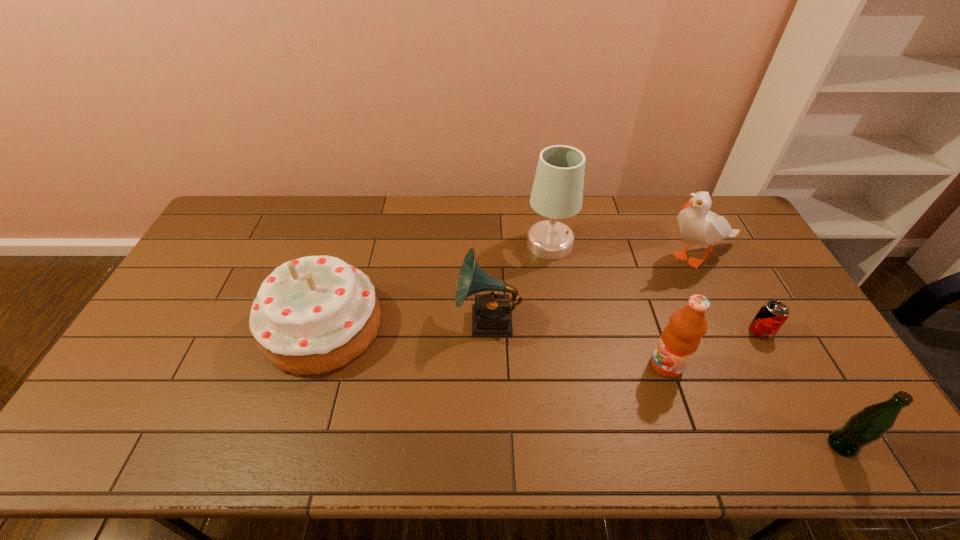
At what (x,y) coordinates should I click in order to perform the action: click on free space located 0.130m on the front of the shortest object. Please return your answer as a coordinate pair (x, y). Looking at the image, I should click on (788, 381).

The width and height of the screenshot is (960, 540). Identify the location of object positioned at the far edge. (557, 193).

The width and height of the screenshot is (960, 540). I want to click on object located at the near edge, so click(x=868, y=425).

The image size is (960, 540). What are the coordinates of `gull present at the right edge` in the screenshot? It's located at (698, 226).

Where is `beer bottle situated at the right edge`? beer bottle situated at the right edge is located at coordinates (868, 425).

The height and width of the screenshot is (540, 960). What are the coordinates of `soda can at the right edge` in the screenshot? It's located at (772, 315).

This screenshot has height=540, width=960. In order to click on object that is positioned at the near right corner in this screenshot , I will do `click(868, 425)`.

Locate an element on the screen. free space at the far edge of the desktop is located at coordinates (485, 216).

In order to click on free spot at the left edge of the desktop in this screenshot , I will do `click(219, 286)`.

Identify the location of vacant region at the right edge of the desktop. The image size is (960, 540). (743, 309).